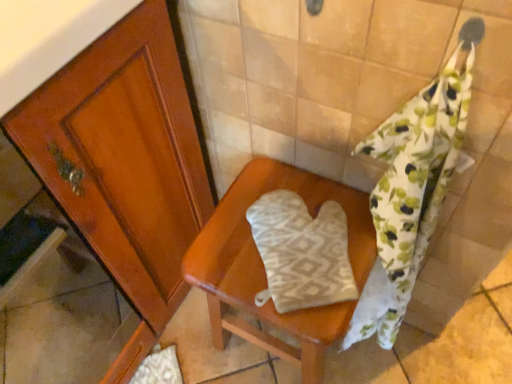
Question: Can you confirm if floral cotton towel at right is taller than beige fabric oven mitt at center?

Choices:
 (A) yes
 (B) no

Answer: (A)

Question: Is floral cotton towel at right facing towards beige fabric oven mitt at center?

Choices:
 (A) no
 (B) yes

Answer: (B)

Question: From a real-world perspective, is floral cotton towel at right located beneath beige fabric oven mitt at center?

Choices:
 (A) yes
 (B) no

Answer: (B)

Question: Is floral cotton towel at right wider than beige fabric oven mitt at center?

Choices:
 (A) no
 (B) yes

Answer: (A)

Question: Is floral cotton towel at right beside beige fabric oven mitt at center?

Choices:
 (A) yes
 (B) no

Answer: (B)

Question: From the image's perspective, is white textured oven mitt at center above or below floral cotton towel at right?

Choices:
 (A) above
 (B) below

Answer: (A)

Question: Is white textured oven mitt at center inside or outside of floral cotton towel at right?

Choices:
 (A) inside
 (B) outside

Answer: (A)

Question: Considering their positions, is white textured oven mitt at center located in front of or behind floral cotton towel at right?

Choices:
 (A) front
 (B) behind

Answer: (B)

Question: Is white textured oven mitt at center wider or thinner than floral cotton towel at right?

Choices:
 (A) wide
 (B) thin

Answer: (A)

Question: Considering their positions, is beige fabric oven mitt at center located in front of or behind white textured oven mitt at center?

Choices:
 (A) front
 (B) behind

Answer: (A)

Question: Would you say beige fabric oven mitt at center is to the left or to the right of white textured oven mitt at center in the picture?

Choices:
 (A) right
 (B) left

Answer: (B)

Question: From a real-world perspective, is beige fabric oven mitt at center physically located above or below white textured oven mitt at center?

Choices:
 (A) below
 (B) above

Answer: (A)

Question: Considering the positions of beige fabric oven mitt at center and white textured oven mitt at center in the image, is beige fabric oven mitt at center taller or shorter than white textured oven mitt at center?

Choices:
 (A) tall
 (B) short

Answer: (A)

Question: From a real-world perspective, is beige fabric oven mitt at center above or below floral cotton towel at right?

Choices:
 (A) below
 (B) above

Answer: (A)

Question: From the image's perspective, is beige fabric oven mitt at center above or below floral cotton towel at right?

Choices:
 (A) above
 (B) below

Answer: (B)